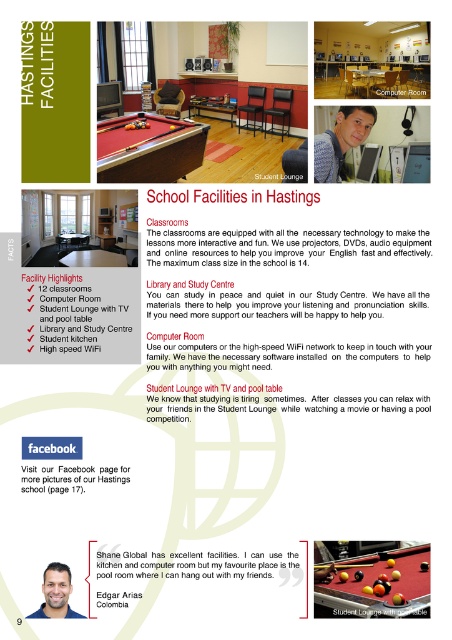
Question: From the image, what is the correct spatial relationship of yellow felt pool table at center in relation to red felt pool table at center?

Choices:
 (A) right
 (B) left

Answer: (A)

Question: Observing the image, what is the correct spatial positioning of yellow felt pool table at center in reference to red felt pool table at center?

Choices:
 (A) right
 (B) left

Answer: (A)

Question: Among these points, which one is nearest to the camera?

Choices:
 (A) (172, 161)
 (B) (325, 588)

Answer: (B)

Question: Is yellow felt pool table at center above red felt pool table at center?

Choices:
 (A) no
 (B) yes

Answer: (A)

Question: Which point is closer to the camera?

Choices:
 (A) (371, 561)
 (B) (142, 131)

Answer: (A)